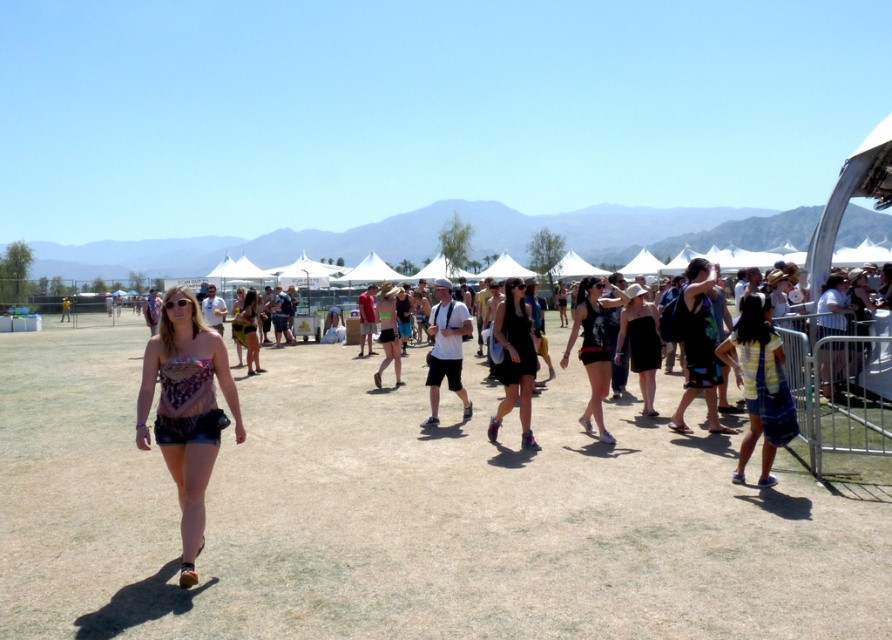
From the picture: You are a photographer at the festival and want to capture both the blue striped dress at right and the black matte dress at center in a single frame. Which dress will appear bigger in the photo?

The blue striped dress at right will appear bigger in the photo because it is larger in size than the black matte dress at center.

You are a photographer at the festival and want to capture both the denim shorts at center and the multicolored fabric dress at right in the same frame. Which clothing item will require you to adjust your camera angle more to include its full width?

The denim shorts at center has a larger width than the multicolored fabric dress at right, so you will need to adjust your camera angle more to include the full width of the denim shorts at center.

You are attending a desert festival and want to choose between two dresses to wear. You have a blue striped dress at right and a black matte dress at center. Which dress is wider?

The blue striped dress at right is wider than the black matte dress at center.